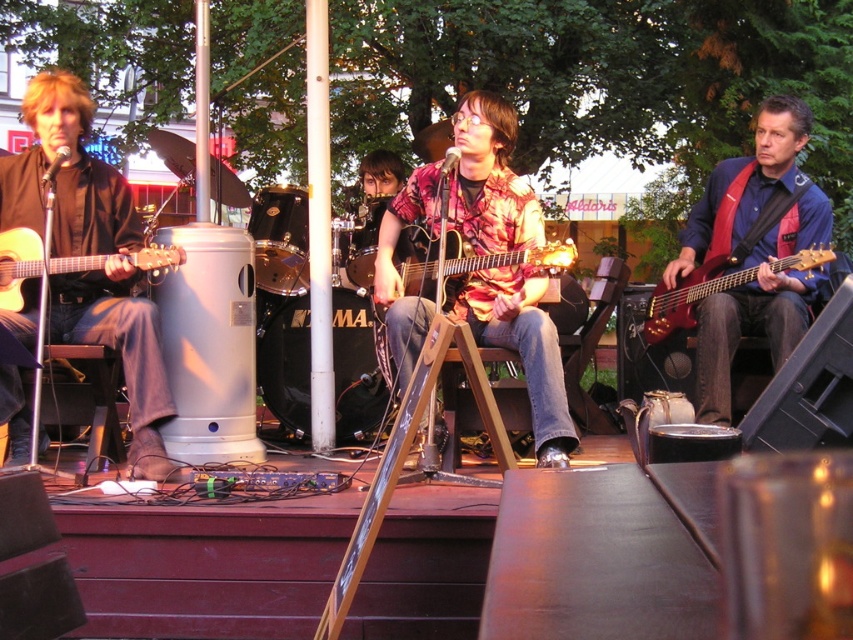
Question: Which of the following is the farthest from the observer?

Choices:
 (A) matte black guitar at center
 (B) matte acoustic guitar at left
 (C) matte black guitar at left

Answer: (B)

Question: Does matte black guitar at left appear under wooden acoustic guitar at center?

Choices:
 (A) yes
 (B) no

Answer: (A)

Question: Which of the following is the farthest from the observer?

Choices:
 (A) (766, 324)
 (B) (64, 122)

Answer: (A)

Question: Is wooden acoustic guitar at center positioned at the back of matte acoustic guitar at left?

Choices:
 (A) yes
 (B) no

Answer: (B)

Question: Is matte floral shirt at center smaller than matte black guitar at center?

Choices:
 (A) no
 (B) yes

Answer: (A)

Question: Which of these objects is positioned closest to the matte black guitar at left?

Choices:
 (A) matte black guitar at center
 (B) shiny red guitar at right
 (C) matte acoustic guitar at left
 (D) matte floral shirt at center

Answer: (A)